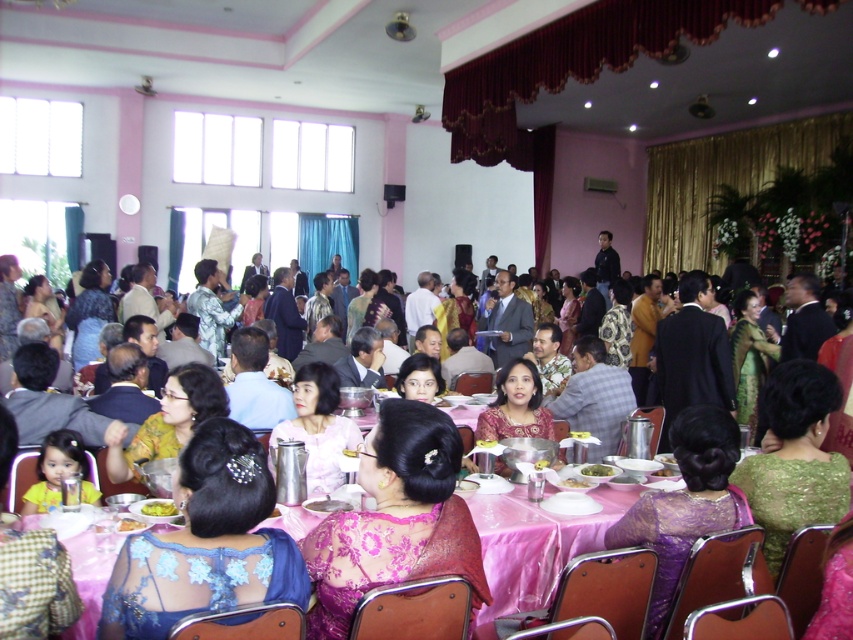
Who is taller, yellow matte bowl at lower center or smooth white plate at center?

With more height is yellow matte bowl at lower center.

Does yellow matte bowl at lower center appear over smooth white plate at center?

Incorrect, yellow matte bowl at lower center is not positioned above smooth white plate at center.

The image size is (853, 640). Find the location of `yellow matte bowl at lower center`. yellow matte bowl at lower center is located at coordinates (158, 508).

Does blue lace dress at center lie in front of pink glossy bowl at center?

Yes.

Describe the element at coordinates (206, 541) in the screenshot. Image resolution: width=853 pixels, height=640 pixels. I see `blue lace dress at center` at that location.

Where is `blue lace dress at center`? blue lace dress at center is located at coordinates (206, 541).

Locate an element on the screen. The height and width of the screenshot is (640, 853). blue lace dress at center is located at coordinates (206, 541).

Does purple lace dress at center have a larger size compared to pink glossy bowl at center?

Yes.

Can you confirm if purple lace dress at center is positioned to the right of pink glossy bowl at center?

Correct, you'll find purple lace dress at center to the right of pink glossy bowl at center.

Is point (669, 529) positioned after point (572, 483)?

No, (669, 529) is closer to viewer.

Where is `purple lace dress at center`? The width and height of the screenshot is (853, 640). purple lace dress at center is located at coordinates (685, 502).